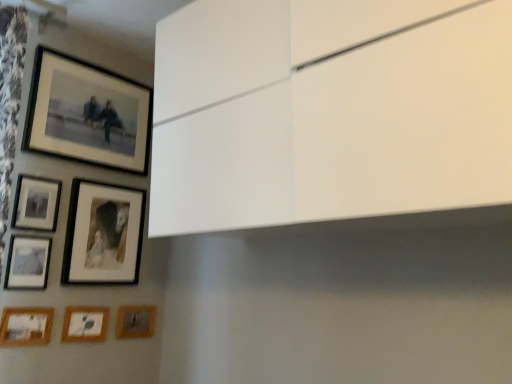
Question: From the image's perspective, would you say wooden matte picture frame at lower left, which ranks as the sixth picture frame in top-to-bottom order, is positioned over wooden photo frame at lower left, acting as the third picture frame starting from the bottom?

Choices:
 (A) no
 (B) yes

Answer: (A)

Question: Is wooden matte picture frame at lower left, which ranks as the sixth picture frame in top-to-bottom order, further to the viewer compared to wooden photo frame at lower left, acting as the third picture frame starting from the bottom?

Choices:
 (A) yes
 (B) no

Answer: (A)

Question: Is the depth of wooden matte picture frame at lower left, which ranks as the sixth picture frame in top-to-bottom order, less than that of wooden photo frame at lower left, acting as the third picture frame starting from the bottom?

Choices:
 (A) no
 (B) yes

Answer: (A)

Question: Does wooden matte picture frame at lower left, the second picture frame ordered from the bottom, appear on the right side of wooden photo frame at lower left, acting as the third picture frame starting from the bottom?

Choices:
 (A) no
 (B) yes

Answer: (B)

Question: Does wooden matte picture frame at lower left, the second picture frame ordered from the bottom, have a smaller size compared to wooden photo frame at lower left, which is counted as the fifth picture frame, starting from the top?

Choices:
 (A) no
 (B) yes

Answer: (B)

Question: Can you confirm if wooden matte picture frame at lower left, the second picture frame ordered from the bottom, is thinner than wooden photo frame at lower left, acting as the third picture frame starting from the bottom?

Choices:
 (A) no
 (B) yes

Answer: (B)

Question: Can you confirm if wooden matte picture frame at lower left, the second picture frame ordered from the bottom, is taller than matte black picture frame at lower left, the fifth picture frame from the bottom?

Choices:
 (A) no
 (B) yes

Answer: (A)

Question: Can you confirm if wooden matte picture frame at lower left, the second picture frame ordered from the bottom, is positioned to the left of matte black picture frame at lower left, the third picture frame from the top?

Choices:
 (A) yes
 (B) no

Answer: (A)

Question: Does wooden matte picture frame at lower left, which ranks as the sixth picture frame in top-to-bottom order, turn towards matte black picture frame at lower left, the third picture frame from the top?

Choices:
 (A) yes
 (B) no

Answer: (B)

Question: From a real-world perspective, is wooden matte picture frame at lower left, which ranks as the sixth picture frame in top-to-bottom order, beneath matte black picture frame at lower left, the third picture frame from the top?

Choices:
 (A) no
 (B) yes

Answer: (B)

Question: Considering the relative sizes of wooden matte picture frame at lower left, which ranks as the sixth picture frame in top-to-bottom order, and matte black picture frame at lower left, the fifth picture frame from the bottom, in the image provided, is wooden matte picture frame at lower left, which ranks as the sixth picture frame in top-to-bottom order, bigger than matte black picture frame at lower left, the fifth picture frame from the bottom,?

Choices:
 (A) yes
 (B) no

Answer: (B)

Question: Is wooden matte picture frame at lower left, the second picture frame ordered from the bottom, at the right side of matte black picture frame at lower left, the third picture frame from the top?

Choices:
 (A) yes
 (B) no

Answer: (B)

Question: From a real-world perspective, is matte black picture frame at upper left, positioned as the second picture frame in top-to-bottom order, physically below wooden matte picture frame at lower left, the second picture frame ordered from the bottom?

Choices:
 (A) no
 (B) yes

Answer: (A)